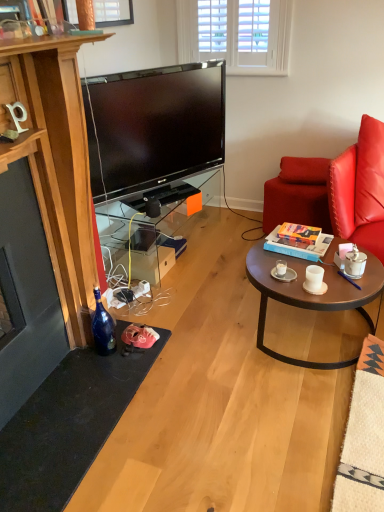
Locate an element on the screen. space that is in front of white matte coffee cup at center right, placed as the 2th coffee cup when sorted from right to left is located at coordinates (327, 293).